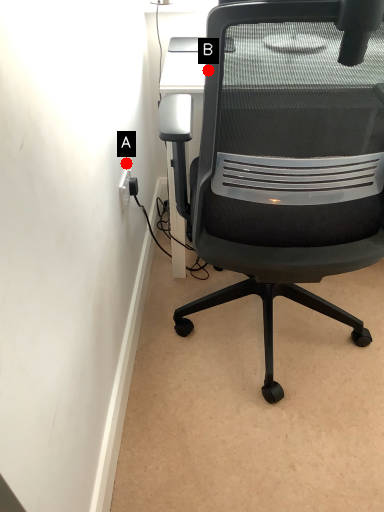
Question: Two points are circled on the image, labeled by A and B beside each circle. Which point appears closest to the camera in this image?

Choices:
 (A) A is closer
 (B) B is closer

Answer: (B)